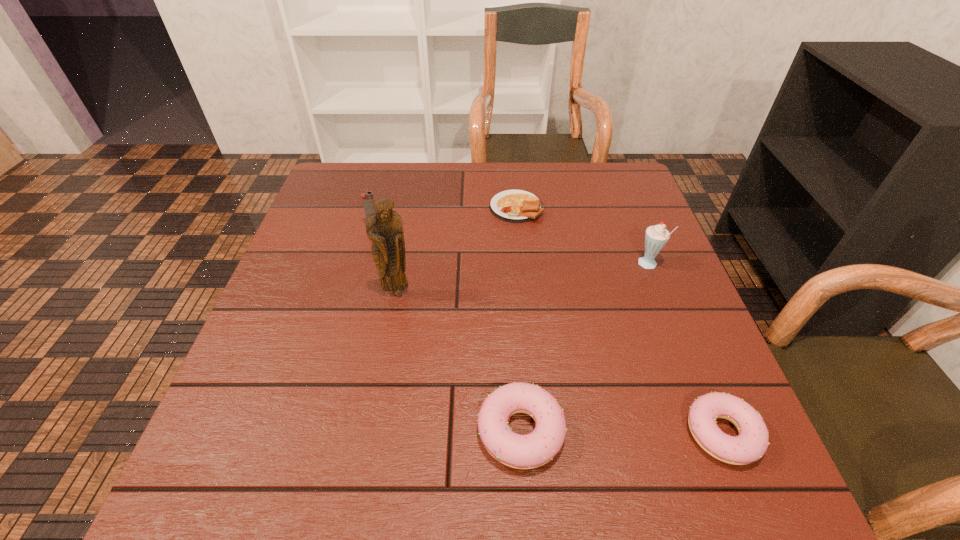
Image resolution: width=960 pixels, height=540 pixels. Identify the location of vacant place for an extra doughnut on the left. (320, 429).